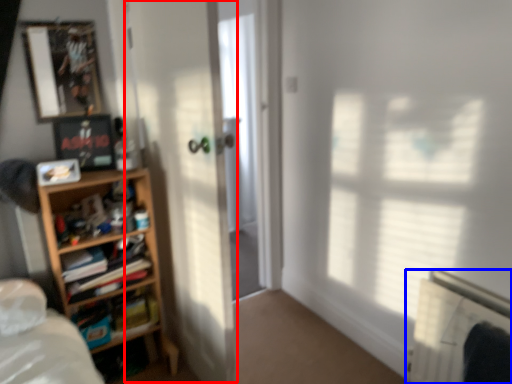
Question: Which object is closer to the camera taking this photo, screen door (highlighted by a red box) or radiator (highlighted by a blue box)?

Choices:
 (A) screen door
 (B) radiator

Answer: (A)